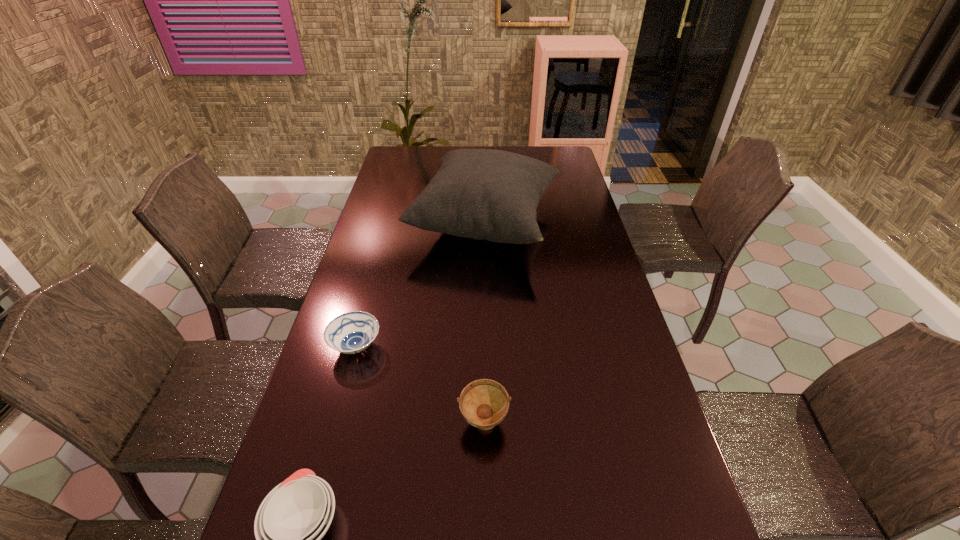
Where is `free space that is in between the rightmost soup bowl and the third nearest object`? free space that is in between the rightmost soup bowl and the third nearest object is located at coordinates (420, 385).

Where is `object identified as the closest to the farthest soup bowl`? This screenshot has height=540, width=960. object identified as the closest to the farthest soup bowl is located at coordinates (484, 194).

Identify the location of object that stands as the third closest to the nearest soup bowl. The height and width of the screenshot is (540, 960). (484, 194).

Identify which soup bowl is the second closest to the second farthest object. Please provide its 2D coordinates. Your answer should be formatted as a tuple, i.e. [(x, y)], where the tuple contains the x and y coordinates of a point satisfying the conditions above.

[(292, 519)]

Identify the location of soup bowl that is the third closest to the farthest object. This screenshot has width=960, height=540. (292, 519).

Find the location of a particular element. The width and height of the screenshot is (960, 540). vacant space that satisfies the following two spatial constraints: 1. on the back side of the third nearest object; 2. on the left side of the farthest object is located at coordinates tap(389, 225).

I want to click on free space that satisfies the following two spatial constraints: 1. on the front side of the second farthest object; 2. on the left side of the tallest soup bowl, so click(x=335, y=423).